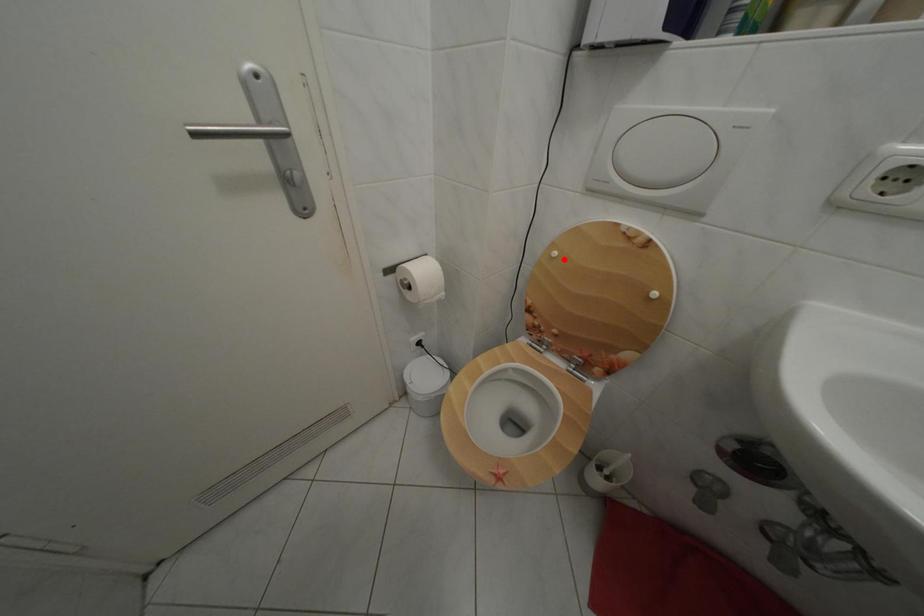
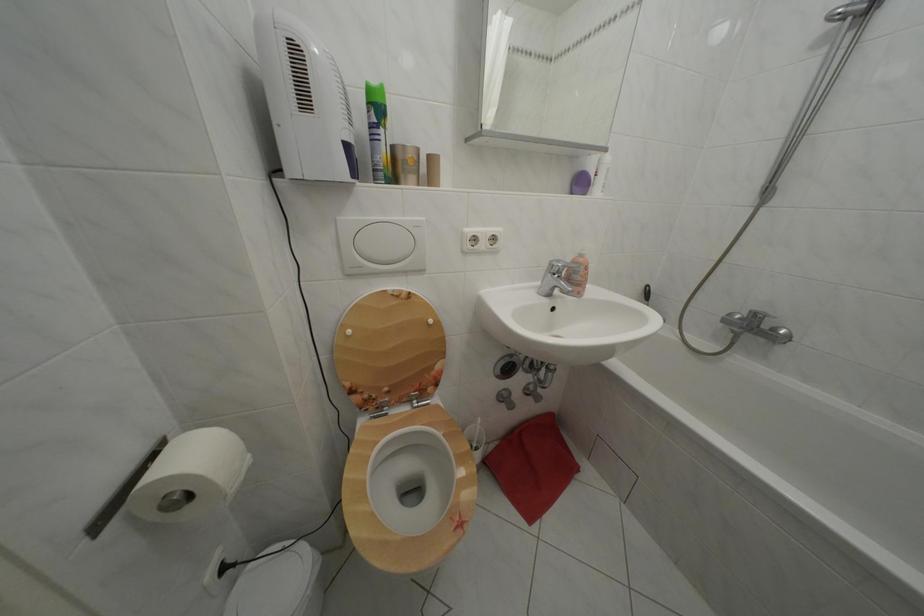
The point at the highlighted location is marked in the first image. Where is the corresponding point in the second image?

(358, 338)